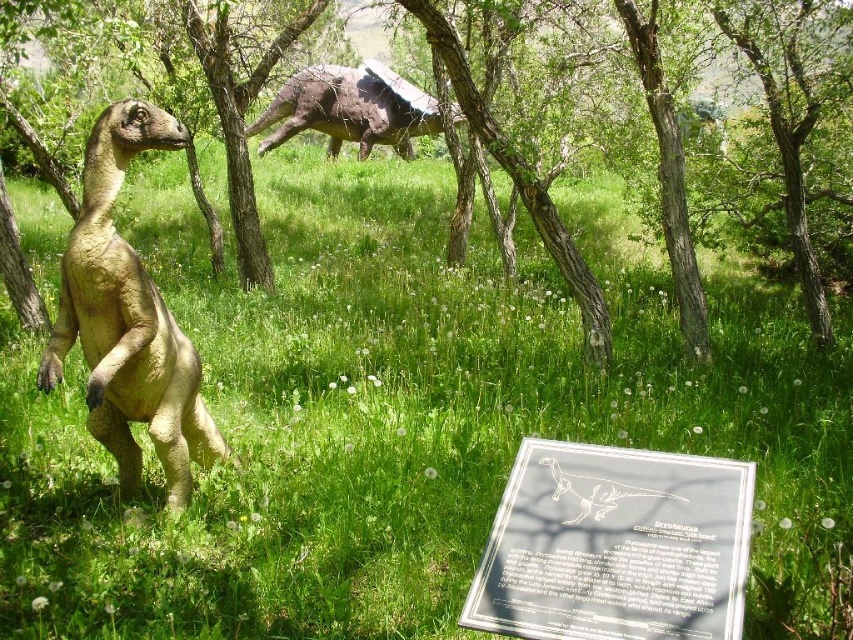
You are a visitor at the exhibit and want to read the information on the transparent glass sign at center. To do that, you need to stand to the left of the green matte tree at center. Is this the correct position?

Yes, because the transparent glass sign at center is to the right of the green matte tree at center, so standing to the left of the green matte tree at center will allow you to see the sign clearly without obstruction.

From the picture: You are a visitor at the exhibit and want to take a photo of the matte brown dinosaur at left and the rustic brown dinosaur at upper center. Which dinosaur should you position to your left side in the frame to capture both in the same photo?

To capture both the matte brown dinosaur at left and the rustic brown dinosaur at upper center in the same photo, position the rustic brown dinosaur at upper center to your left side in the frame. This is because the matte brown dinosaur at left is actually to the right of the rustic brown dinosaur at upper center, so arranging the rustic one on your left will allow both to be included in the shot.

Looking at this image, you are a visitor at the exhibit and want to take a photo of both the green matte tree at center and the rustic brown dinosaur at upper center. Based on their positions, which object should you place on the left side of your photo to include both in the frame?

The rustic brown dinosaur at upper center should be placed on the left side of your photo because the green matte tree at center is positioned to the right of it.